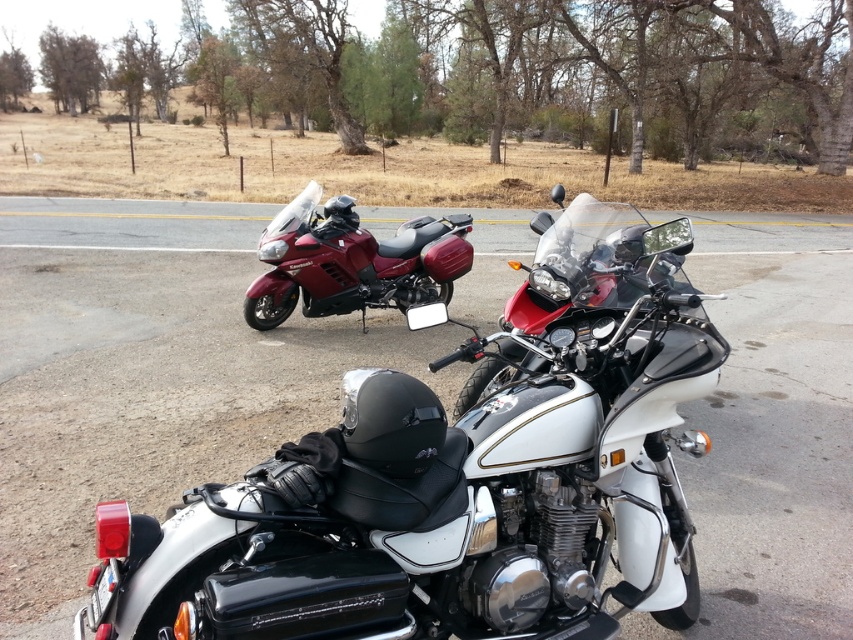
You are a photographer standing at the edge of the road where both motorcycles are parked. You want to take a photo that captures both motorcycles in the frame without any part of them being cut off. Given that your camera has a maximum field of view that can capture objects up to 3 meters apart, can you fit both the white metallic motorcycle at center and the glossy red motorcycle at center in the same shot?

The white metallic motorcycle at center is 2.30 meters away from the glossy red motorcycle at center. Since the distance between them is less than the camera field of view limit of 3 meters, both motorcycles can be captured in the same photo without any parts being cut off.

You are a delivery person who needs to park your motorcycle between the white metallic motorcycle at center and the road edge. Given that the road edge is at point 0.3 on the x and y coordinates, can you fit your motorcycle there?

The white metallic motorcycle at center is located at point (x=148, y=376). Since the road edge is at 0.3, the distance between them is 0.284 units. If your motorcycle requires at least this space to park, it might be possible, but you need to ensure there is enough room between the white metallic motorcycle at center and the road edge.